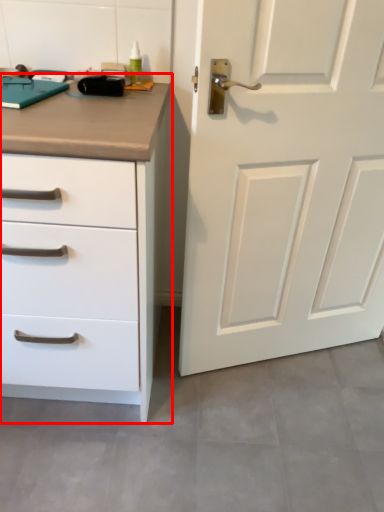
Question: From the image's perspective, what is the correct spatial relationship of chest of drawers (annotated by the red box) in relation to door?

Choices:
 (A) below
 (B) above

Answer: (A)